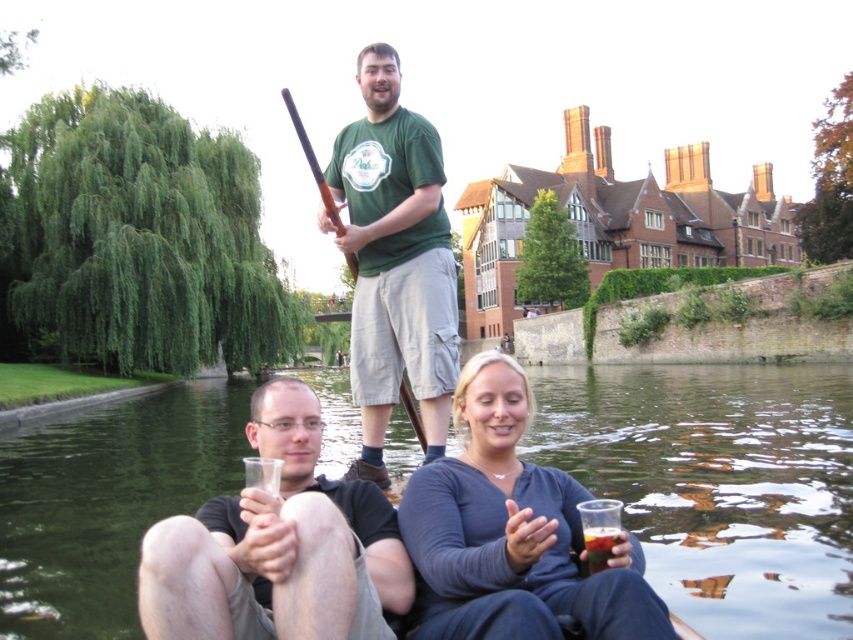
Question: Is matte black t-shirt at lower center closer to camera compared to translucent glass at lower right?

Choices:
 (A) no
 (B) yes

Answer: (B)

Question: Which point is closer to the camera taking this photo?

Choices:
 (A) (552, 426)
 (B) (373, 397)
 (C) (268, 502)

Answer: (C)

Question: Which point is closer to the camera?

Choices:
 (A) greenish water at center
 (B) matte gray sweater at center
 (C) translucent glass at lower right
 (D) matte black t-shirt at lower center

Answer: (B)

Question: Which is farther from the green t-shirt at center?

Choices:
 (A) greenish water at center
 (B) translucent glass at lower right

Answer: (A)

Question: Does matte black t-shirt at lower center have a lesser width compared to matte gray sweater at center?

Choices:
 (A) no
 (B) yes

Answer: (A)

Question: Does matte gray sweater at center appear over green t-shirt at center?

Choices:
 (A) yes
 (B) no

Answer: (B)